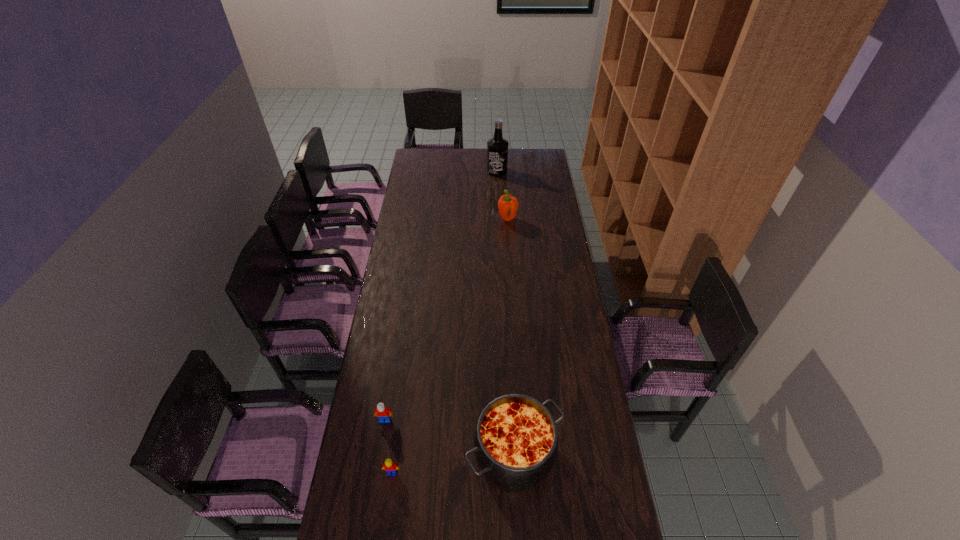
Where is `object that stands as the closest to the pepper`? object that stands as the closest to the pepper is located at coordinates (497, 147).

I want to click on object that can be found as the third closest to the casserole, so click(x=507, y=205).

Where is `vacant area in the image that satisfies the following two spatial constraints: 1. on the face of the taller Lego; 2. on the left side of the casserole`? The width and height of the screenshot is (960, 540). vacant area in the image that satisfies the following two spatial constraints: 1. on the face of the taller Lego; 2. on the left side of the casserole is located at coordinates coord(379,455).

The width and height of the screenshot is (960, 540). What are the coordinates of `vacant space that satisfies the following two spatial constraints: 1. on the back side of the casserole; 2. on the left side of the pepper` in the screenshot? It's located at (501, 219).

Identify the location of vacant point that satisfies the following two spatial constraints: 1. on the face of the second shortest object; 2. on the left side of the casserole. (379, 455).

Identify the location of vacant space that satisfies the following two spatial constraints: 1. on the front label of the pepper; 2. on the right side of the liquor. This screenshot has height=540, width=960. (499, 219).

Locate an element on the screen. The width and height of the screenshot is (960, 540). vacant space that satisfies the following two spatial constraints: 1. on the face of the casserole; 2. on the right side of the second shortest object is located at coordinates (379, 455).